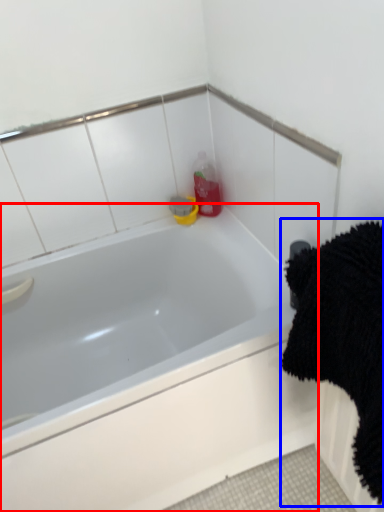
Question: Which of the following is the farthest to the observer, bathtub (highlighted by a red box) or bath towel (highlighted by a blue box)?

Choices:
 (A) bathtub
 (B) bath towel

Answer: (A)